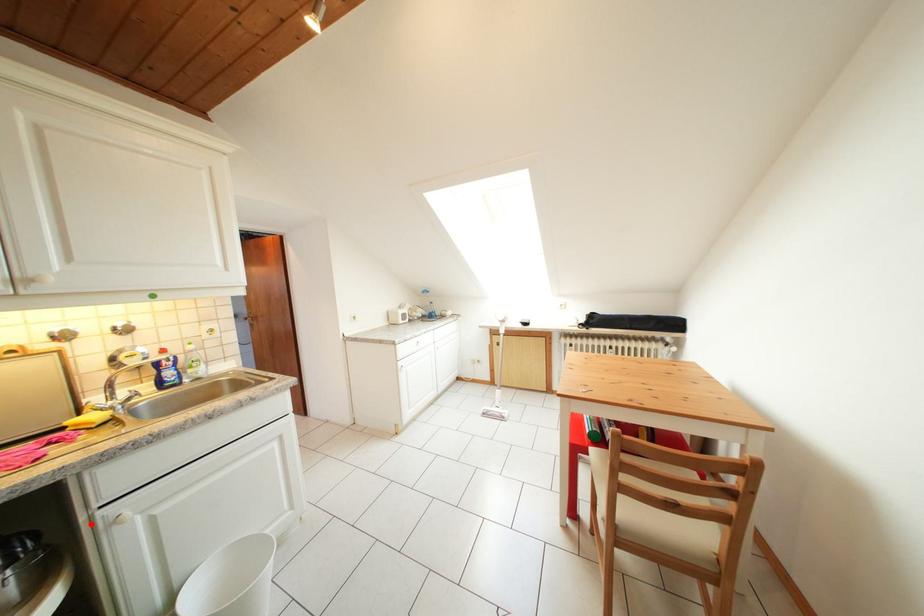
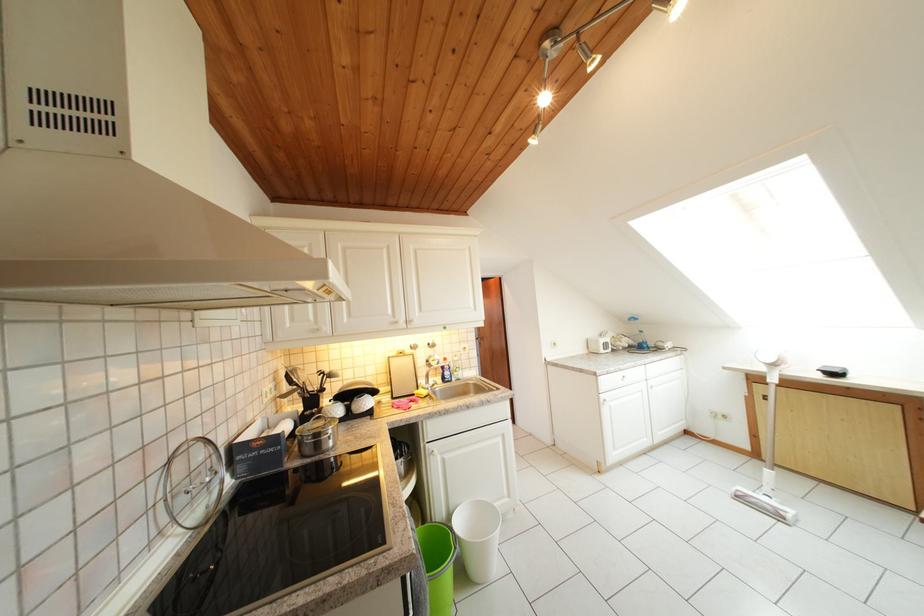
Where in the second image is the point corresponding to the highlighted location from the first image?

(431, 451)